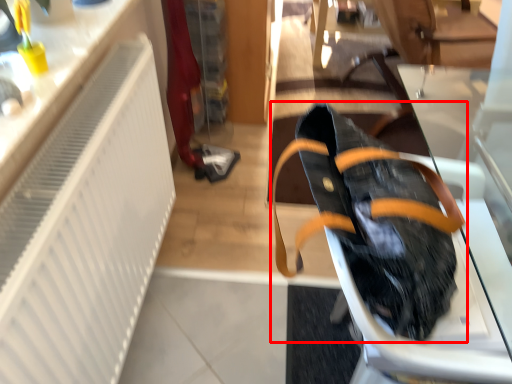
Question: In this image, where is footwear (annotated by the red box) located relative to radiator?

Choices:
 (A) right
 (B) left

Answer: (A)